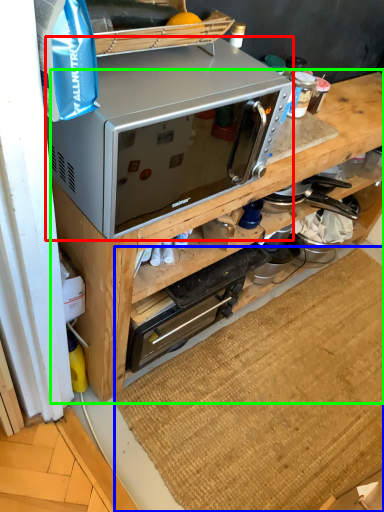
Question: Which object is the closest to the microwave oven (highlighted by a red box)? Choose among these: doormat (highlighted by a blue box) or cabinetry (highlighted by a green box).

Choices:
 (A) doormat
 (B) cabinetry

Answer: (B)